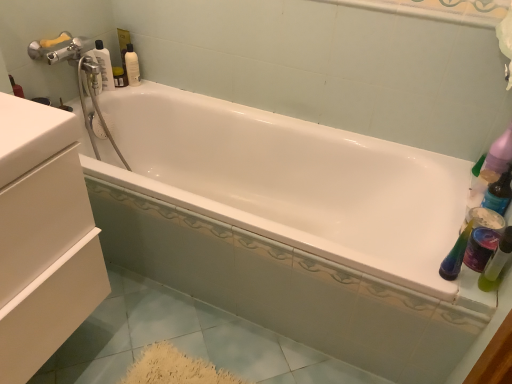
What is the approximate width of white glossy mouthwash at upper left, placed as the 1th mouthwash when sorted from top to bottom?

white glossy mouthwash at upper left, placed as the 1th mouthwash when sorted from top to bottom, is 2.76 inches wide.

What do you see at coordinates (51, 309) in the screenshot? I see `white matte drawer at left` at bounding box center [51, 309].

The image size is (512, 384). In order to click on white glossy mouthwash at upper left, placed as the 1th mouthwash when sorted from top to bottom in this screenshot , I will do pos(132,66).

From the image's perspective, is transparent plastic bottle at upper left located above white glossy mouthwash at upper left, placed as the 1th mouthwash when sorted from top to bottom?

Incorrect, from the image's perspective, transparent plastic bottle at upper left is lower than white glossy mouthwash at upper left, placed as the 1th mouthwash when sorted from top to bottom.

Would you say transparent plastic bottle at upper left is outside white glossy mouthwash at upper left, the first mouthwash in the left-to-right sequence?

Yes, transparent plastic bottle at upper left is not within white glossy mouthwash at upper left, the first mouthwash in the left-to-right sequence.

Could you tell me if transparent plastic bottle at upper left is turned towards white glossy mouthwash at upper left, marked as the first mouthwash in a back-to-front arrangement?

No, transparent plastic bottle at upper left is not oriented towards white glossy mouthwash at upper left, marked as the first mouthwash in a back-to-front arrangement.

Which point is more forward, (106, 56) or (132, 80)?

The point (106, 56) is in front.

Does green translucent bottle at right, the first mouthwash when ordered from right to left, have a lesser width compared to white matte drawer at left?

Correct, the width of green translucent bottle at right, the first mouthwash when ordered from right to left, is less than that of white matte drawer at left.

Is green translucent bottle at right, the 1th mouthwash viewed from the front, next to white matte drawer at left and touching it?

No, green translucent bottle at right, the 1th mouthwash viewed from the front, is not beside white matte drawer at left.

You are a GUI agent. You are given a task and a screenshot of the screen. Output one action in this format:
    pyautogui.click(x=<x>, y=<y>)
    Task: Click on the drawer lying on the left of green translucent bottle at right, positioned as the second mouthwash in top-to-bottom order
    
    Given the screenshot: What is the action you would take?
    pyautogui.click(x=51, y=309)

Between point (506, 245) and point (28, 316), which one is positioned in front?

The point (28, 316) is closer to the camera.

Between white matte drawer at left and white glossy mouthwash at upper left, the first mouthwash in the left-to-right sequence, which one has less height?

Standing shorter between the two is white glossy mouthwash at upper left, the first mouthwash in the left-to-right sequence.

Which is correct: white matte drawer at left is inside white glossy mouthwash at upper left, marked as the first mouthwash in a back-to-front arrangement, or outside of it?

The correct answer is: outside.

Does white matte drawer at left appear on the left side of white glossy mouthwash at upper left, placed as the 1th mouthwash when sorted from top to bottom?

Yes.

Is white matte drawer at left turned away from white glossy mouthwash at upper left, marked as the first mouthwash in a back-to-front arrangement?

No.

Would you say green translucent bottle at right, positioned as the second mouthwash in top-to-bottom order, is outside white glossy mouthwash at upper left, the second mouthwash in the right-to-left sequence?

Indeed, green translucent bottle at right, positioned as the second mouthwash in top-to-bottom order, is completely outside white glossy mouthwash at upper left, the second mouthwash in the right-to-left sequence.

From a real-world perspective, which is physically below, green translucent bottle at right, arranged as the second mouthwash when viewed from the back, or white glossy mouthwash at upper left, the second mouthwash in the right-to-left sequence?

In real-world perspective, green translucent bottle at right, arranged as the second mouthwash when viewed from the back, is lower.

In the scene shown: Is the position of green translucent bottle at right, positioned as the second mouthwash in top-to-bottom order, more distant than that of white glossy mouthwash at upper left, marked as the first mouthwash in a back-to-front arrangement?

No, green translucent bottle at right, positioned as the second mouthwash in top-to-bottom order, is in front of white glossy mouthwash at upper left, marked as the first mouthwash in a back-to-front arrangement.

From the image's perspective, which is above, green translucent bottle at right, the 2th mouthwash positioned from the left, or white glossy mouthwash at upper left, acting as the second mouthwash starting from the front?

From the image's view, white glossy mouthwash at upper left, acting as the second mouthwash starting from the front, is above.

Find the location of a particular element. the 2nd mouthwash behind the white matte drawer at left, counting from the anchor's position is located at coordinates (132, 66).

Which of these two, white glossy mouthwash at upper left, placed as the 1th mouthwash when sorted from top to bottom, or white matte drawer at left, is smaller?

white glossy mouthwash at upper left, placed as the 1th mouthwash when sorted from top to bottom.

From the picture: Which is more distant, (136, 71) or (74, 293)?

Positioned behind is point (136, 71).

Is white glossy mouthwash at upper left, the first mouthwash in the left-to-right sequence, in front of white matte drawer at left?

No, white glossy mouthwash at upper left, the first mouthwash in the left-to-right sequence, is behind white matte drawer at left.

In the scene shown: Considering the positions of objects transparent plastic bottle at upper left and green translucent bottle at right, the 2th mouthwash positioned from the left, in the image provided, who is behind, transparent plastic bottle at upper left or green translucent bottle at right, the 2th mouthwash positioned from the left,?

transparent plastic bottle at upper left.

Is transparent plastic bottle at upper left to the right of green translucent bottle at right, arranged as the second mouthwash when viewed from the back, from the viewer's perspective?

No.

This screenshot has width=512, height=384. In order to click on mouthwash in front of the transparent plastic bottle at upper left in this screenshot , I will do [496, 262].

Is transparent plastic bottle at upper left aimed at white matte drawer at left?

No, transparent plastic bottle at upper left is not turned towards white matte drawer at left.

Based on the photo, can you tell me how much transparent plastic bottle at upper left and white matte drawer at left differ in facing direction?

The angle between the facing direction of transparent plastic bottle at upper left and the facing direction of white matte drawer at left is 1.02 degrees.

Identify the location of bottle above the white matte drawer at left (from a real-world perspective). The image size is (512, 384). (104, 66).

Would you say transparent plastic bottle at upper left is a long distance from white matte drawer at left?

transparent plastic bottle at upper left is actually quite close to white matte drawer at left.

The height and width of the screenshot is (384, 512). I want to click on mouthwash lying behind the transparent plastic bottle at upper left, so [132, 66].

I want to click on drawer lying on the left of green translucent bottle at right, the first mouthwash when ordered from right to left, so click(x=51, y=309).

Considering their positions, is transparent plastic bottle at upper left positioned closer to white matte drawer at left than white glossy mouthwash at upper left, marked as the first mouthwash in a back-to-front arrangement?

Among the two, transparent plastic bottle at upper left is located nearer to white matte drawer at left.

Based on the photo, considering their positions, is white glossy mouthwash at upper left, placed as the 1th mouthwash when sorted from top to bottom, positioned further to white matte drawer at left than transparent plastic bottle at upper left?

white glossy mouthwash at upper left, placed as the 1th mouthwash when sorted from top to bottom.

Estimate the real-world distances between objects in this image. Which object is further from white matte drawer at left, transparent plastic bottle at upper left or green translucent bottle at right, arranged as the second mouthwash when viewed from the back?

green translucent bottle at right, arranged as the second mouthwash when viewed from the back, lies further to white matte drawer at left than the other object.

Which object lies nearer to the anchor point green translucent bottle at right, the first mouthwash when ordered from right to left, white glossy mouthwash at upper left, the first mouthwash in the left-to-right sequence, or transparent plastic bottle at upper left?

Among the two, transparent plastic bottle at upper left is located nearer to green translucent bottle at right, the first mouthwash when ordered from right to left.

Based on their spatial positions, is green translucent bottle at right, the 1th mouthwash viewed from the front, or white matte drawer at left closer to transparent plastic bottle at upper left?

white matte drawer at left.

From the image, which object appears to be nearer to green translucent bottle at right, the first mouthwash when ordered from right to left, white matte drawer at left or transparent plastic bottle at upper left?

white matte drawer at left.

Based on their spatial positions, is transparent plastic bottle at upper left or white matte drawer at left further from white glossy mouthwash at upper left, the second mouthwash in the right-to-left sequence?

Based on the image, white matte drawer at left appears to be further to white glossy mouthwash at upper left, the second mouthwash in the right-to-left sequence.

Considering their positions, is white glossy mouthwash at upper left, the second mouthwash in the right-to-left sequence, positioned closer to transparent plastic bottle at upper left than white matte drawer at left?

The object closer to transparent plastic bottle at upper left is white glossy mouthwash at upper left, the second mouthwash in the right-to-left sequence.

At what (x,y) coordinates should I click in order to perform the action: click on bottle located between white matte drawer at left and green translucent bottle at right, the first mouthwash when ordered from right to left, in the left-right direction. Please return your answer as a coordinate pair (x, y). The width and height of the screenshot is (512, 384). Looking at the image, I should click on click(x=104, y=66).

Locate an element on the screen. This screenshot has height=384, width=512. mouthwash between transparent plastic bottle at upper left and green translucent bottle at right, the 1th mouthwash viewed from the front is located at coordinates (132, 66).

Find the location of a particular element. The width and height of the screenshot is (512, 384). bottle between white matte drawer at left and white glossy mouthwash at upper left, placed as the 1th mouthwash when sorted from top to bottom, from front to back is located at coordinates (104, 66).

At what (x,y) coordinates should I click in order to perform the action: click on mouthwash located between white matte drawer at left and green translucent bottle at right, arranged as the second mouthwash when viewed from the back, in the left-right direction. Please return your answer as a coordinate pair (x, y). Looking at the image, I should click on (132, 66).